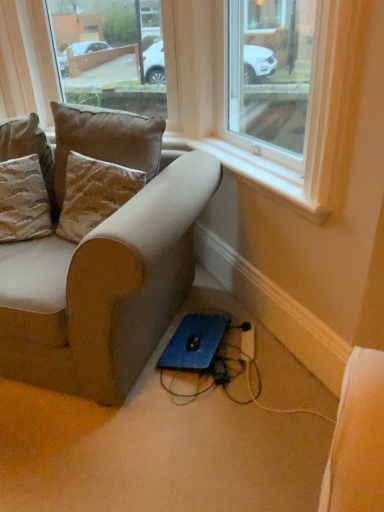
Locate an element on the screen. This screenshot has height=512, width=384. vacant space situated above white plastic window sill at upper center (from a real-world perspective) is located at coordinates (248, 159).